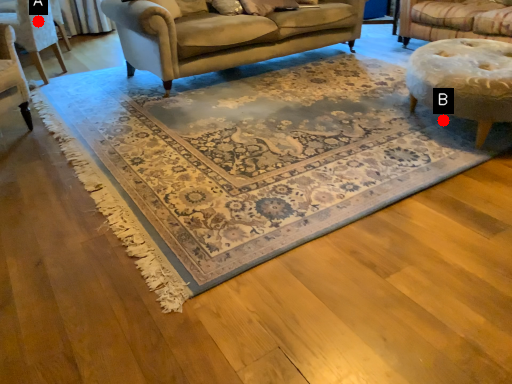
Question: Two points are circled on the image, labeled by A and B beside each circle. Which point is closer to the camera?

Choices:
 (A) A is closer
 (B) B is closer

Answer: (B)